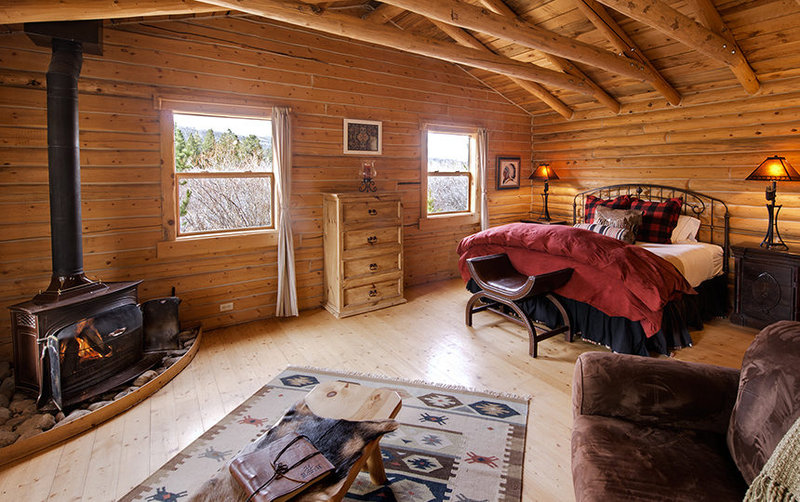
Where is `drawers`? The image size is (800, 502). drawers is located at coordinates (360, 205), (362, 239), (366, 266), (370, 295).